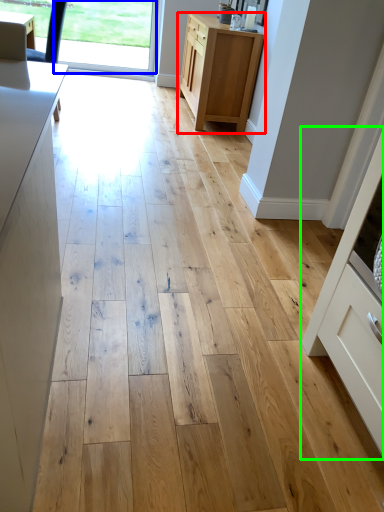
Question: Considering the real-world distances, which object is farthest from cabinetry (highlighted by a red box)? window screen (highlighted by a blue box) or cabinetry (highlighted by a green box)?

Choices:
 (A) window screen
 (B) cabinetry

Answer: (B)